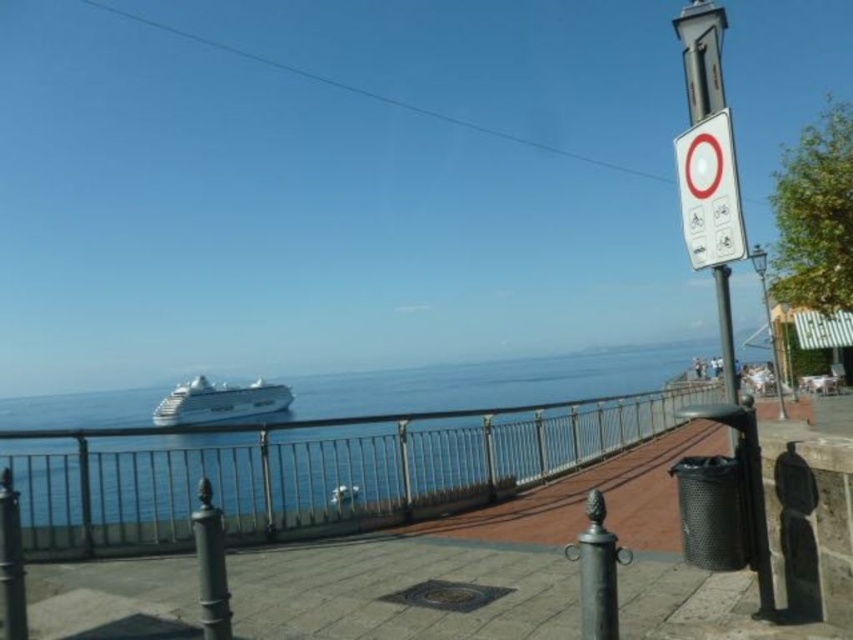
Can you confirm if blue water at center is positioned above white plastic sign at upper right?

Actually, blue water at center is below white plastic sign at upper right.

Is point (554, 385) farther from camera compared to point (698, 198)?

Yes, it is.

Does point (300, 518) come behind point (711, 241)?

Yes, point (300, 518) is farther from viewer.

This screenshot has height=640, width=853. Find the location of `blue water at center`. blue water at center is located at coordinates (310, 468).

Locate an element on the screen. white plastic sign at upper right is located at coordinates (709, 193).

The height and width of the screenshot is (640, 853). What do you see at coordinates (709, 193) in the screenshot? I see `white plastic sign at upper right` at bounding box center [709, 193].

Identify the location of white plastic sign at upper right. This screenshot has height=640, width=853. (709, 193).

Is point (480, 497) closer to viewer compared to point (219, 397)?

Yes, it is in front of point (219, 397).

Is blue water at center in front of white glossy cruise ship at center?

Yes, it is in front of white glossy cruise ship at center.

You are a GUI agent. You are given a task and a screenshot of the screen. Output one action in this format:
    pyautogui.click(x=<x>, y=<y>)
    Task: Click on the blue water at center
    This screenshot has height=640, width=853.
    Given the screenshot: What is the action you would take?
    pyautogui.click(x=310, y=468)